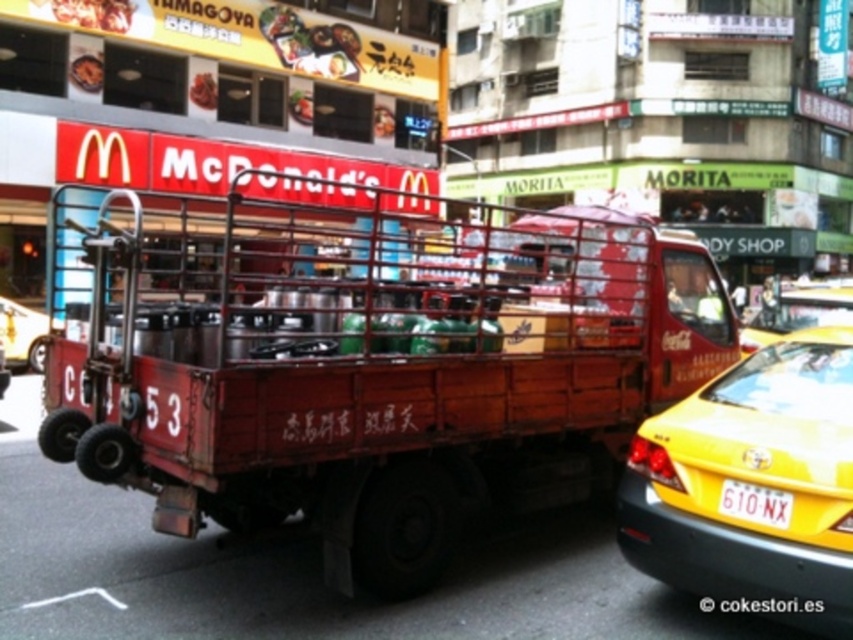
You are a pedestrian standing on the sidewalk and see the metallic silver car at left and the yellow plastic license plate at lower right. Which object is closer to the left edge of the image?

The metallic silver car at left is closer to the left edge of the image because it is positioned on the left side of the yellow plastic license plate at lower right.

You are standing at the point with coordinates point (323, 228). You want to walk to the point with coordinates point (759, 508). Which direction should you move first?

Since point (323, 228) is behind point (759, 508), you should move forward to reach it.

You are a delivery driver who needs to park your van between the rusty metal truck at center and the metallic silver car at left. The van is 6 meters long. Can you safely park your van between them without overlapping either vehicle?

The distance between the rusty metal truck at center and the metallic silver car at left is 5.92 meters. Since the van is 6 meters long, it would not fit as the space is slightly shorter than the vehicle. You cannot safely park the van between them without overlapping either vehicle.